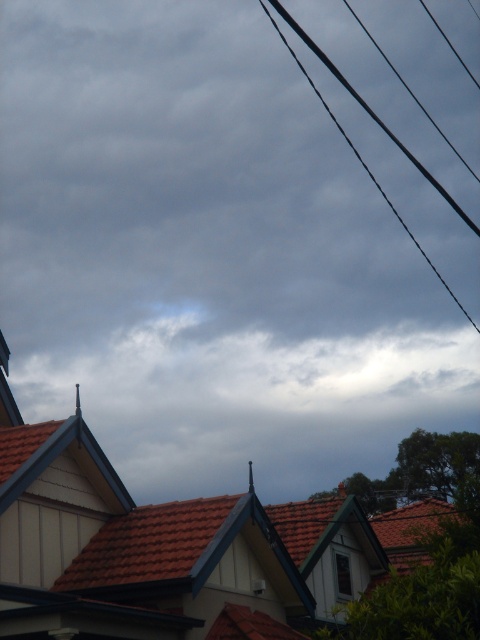
You are standing in the middle of the image and want to locate the brown tile roof at center. According to the coordinates provided, in which direction should you look to find it?

The brown tile roof at center is located at point (159, 548), so you should look to the lower right direction from the center of the image.

You are standing in the middle of the image and notice two elements in the scene. One is the brown tile roof at center and the other is the black wire at upper right. Which of these two objects is positioned more to the left?

The brown tile roof at center is positioned to the left of the black wire at upper right, so the brown tile roof at center is more to the left.